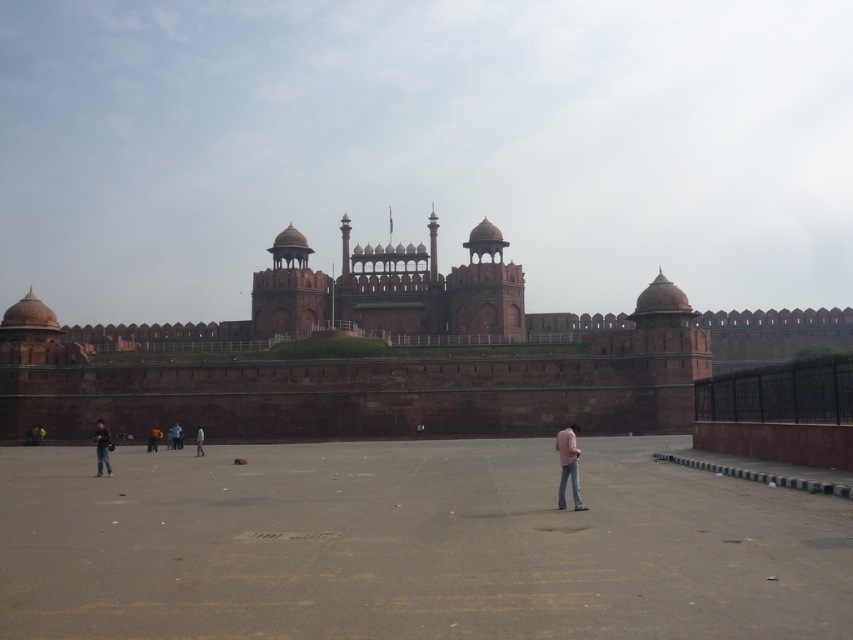
Question: Which of the following is the farthest from the observer?

Choices:
 (A) (577, 497)
 (B) (178, 436)

Answer: (B)

Question: Is red stone palace at center to the right of light gray fabric jacket at center from the viewer's perspective?

Choices:
 (A) no
 (B) yes

Answer: (B)

Question: Considering the real-world distances, which object is farthest from the red stone palace at center?

Choices:
 (A) pink fabric at center
 (B) light blue jeans at center

Answer: (A)

Question: Is red stone palace at center to the right of dark blue jeans at lower left from the viewer's perspective?

Choices:
 (A) no
 (B) yes

Answer: (B)

Question: Estimate the real-world distances between objects in this image. Which object is closer to the light blue jeans at center?

Choices:
 (A) red stone palace at center
 (B) dark blue jeans at left
 (C) light gray fabric jacket at center

Answer: (C)

Question: Does red stone palace at center appear under dark blue jeans at left?

Choices:
 (A) yes
 (B) no

Answer: (B)